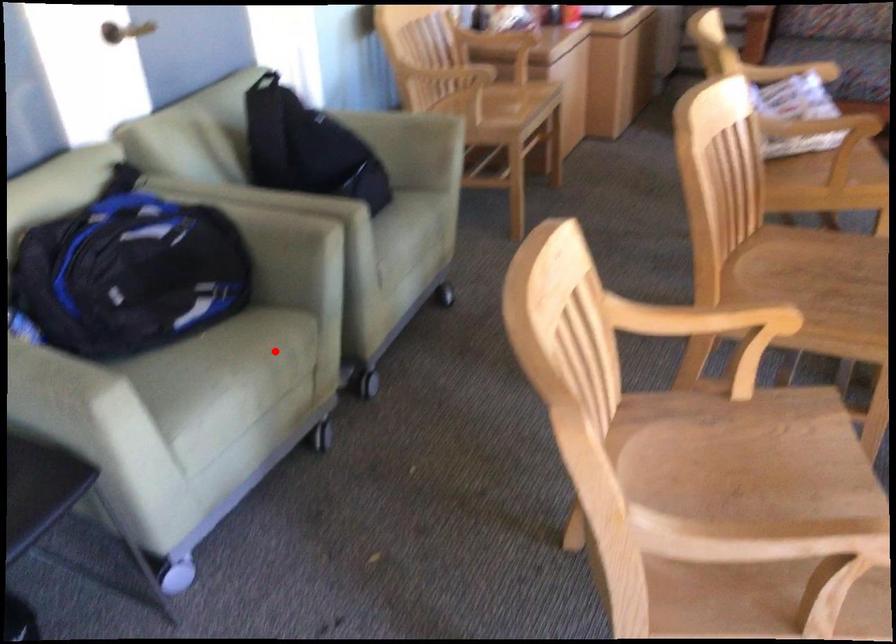
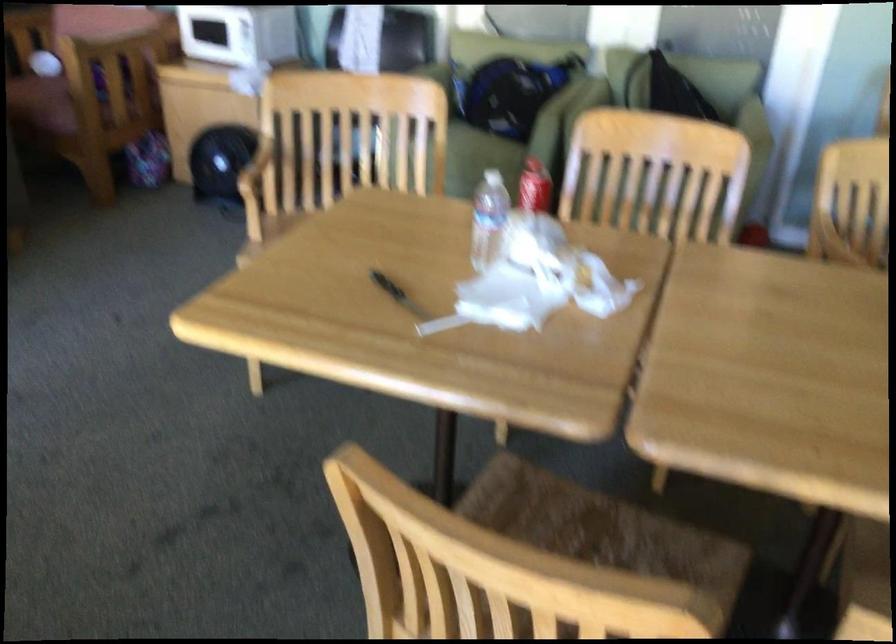
Question: I am providing you with two images of the same scene from different viewpoints. Given a red point in image1, look at the same physical point in image2. Is it:

Choices:
 (A) Closer to the viewpoint
 (B) Farther from the viewpoint

Answer: (B)